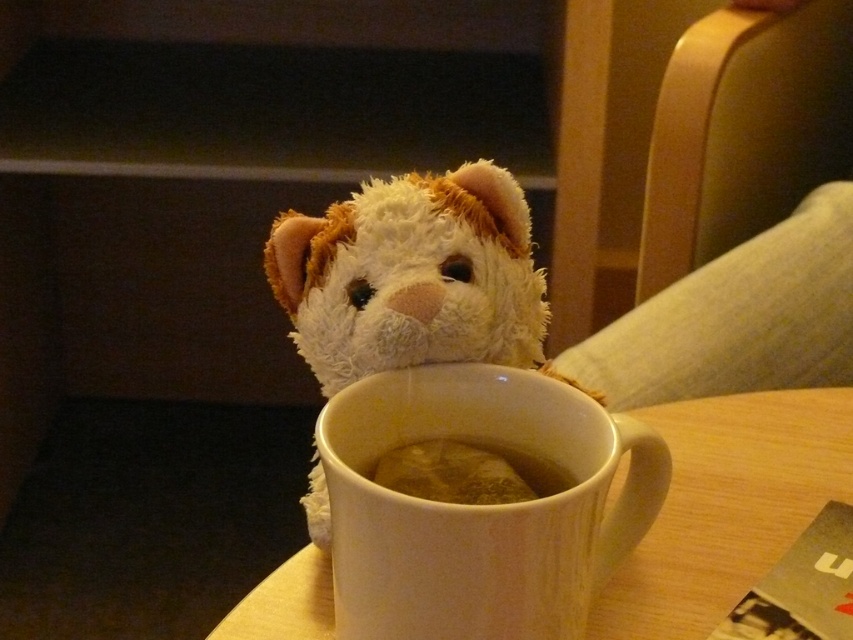
From the picture: You are arranging items on a table for a tea party. You have a white matte mug at center and a brown matte coffee at center. According to the scene, which item is positioned to the right?

The white matte mug at center is to the right of the brown matte coffee at center.

From the picture: You are a person with a 30 cm long ruler. You want to measure the distance from your eyes to the white matte mug at center. Can you reach the mug with your ruler?

The white matte mug at center is 30.55 centimeters away from viewer. Since the ruler is 30 cm long, it is slightly shorter than the distance. Therefore, the ruler cannot fully reach the mug.

You are a barista preparing a drink and see the white matte mug at center and the brown matte coffee at center. Which object is positioned lower in the image?

The white matte mug at center is located below the brown matte coffee at center, so it is positioned lower in the image.